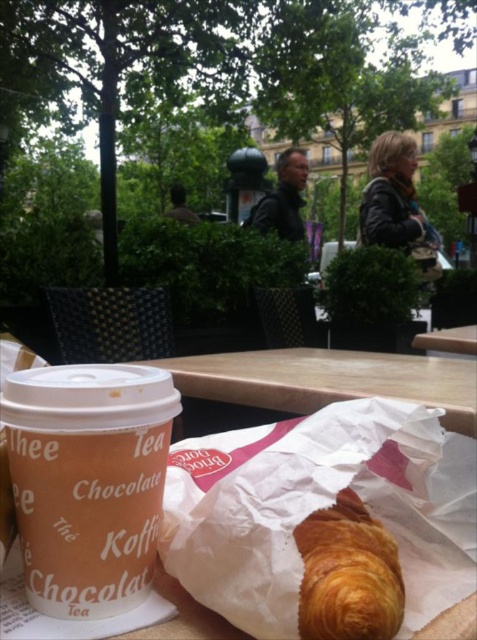
Between brown paper cup at lower left and golden flaky croissant at center, which one has less height?

golden flaky croissant at center is shorter.

How much distance is there between brown paper cup at lower left and golden flaky croissant at center?

12.95 centimeters

Which is in front, point (51, 376) or point (403, 604)?

Point (403, 604) is more forward.

Where is `brown paper cup at lower left`? The image size is (477, 640). brown paper cup at lower left is located at coordinates (87, 481).

Is point (394, 376) closer to camera compared to point (354, 492)?

No.

The image size is (477, 640). What are the coordinates of `wooden table at center` in the screenshot? It's located at (327, 380).

Locate an element on the screen. This screenshot has height=640, width=477. wooden table at center is located at coordinates (327, 380).

Can you confirm if brown paper cup at lower left is bigger than wooden table at center?

No, brown paper cup at lower left is not bigger than wooden table at center.

Between brown paper cup at lower left and wooden table at center, which one is positioned higher?

brown paper cup at lower left is higher up.

Who is more forward, (10, 388) or (244, 401)?

Positioned in front is point (10, 388).

I want to click on brown paper cup at lower left, so coord(87,481).